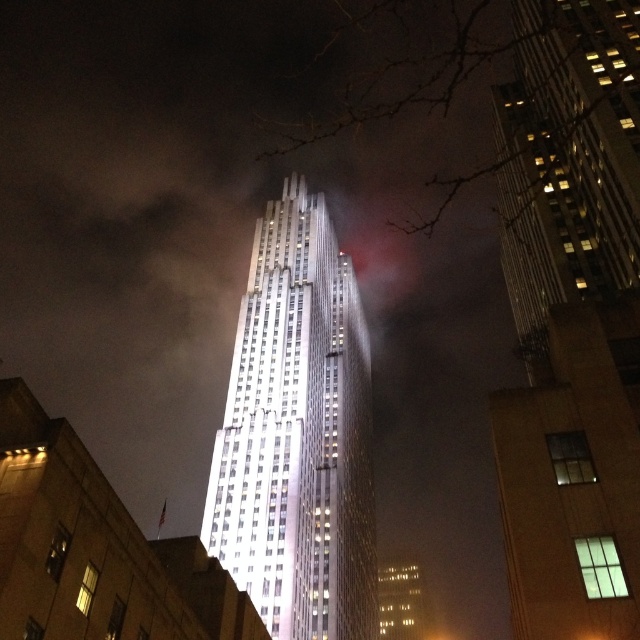
Question: Does reflective glass skyscraper at center have a larger size compared to shiny glass tower at center?

Choices:
 (A) yes
 (B) no

Answer: (B)

Question: Is reflective glass skyscraper at center closer to the viewer compared to shiny glass tower at center?

Choices:
 (A) no
 (B) yes

Answer: (B)

Question: Which object is closer to the camera taking this photo?

Choices:
 (A) reflective glass skyscraper at center
 (B) shiny glass tower at center

Answer: (A)

Question: Can you confirm if reflective glass skyscraper at center is wider than shiny glass tower at center?

Choices:
 (A) no
 (B) yes

Answer: (A)